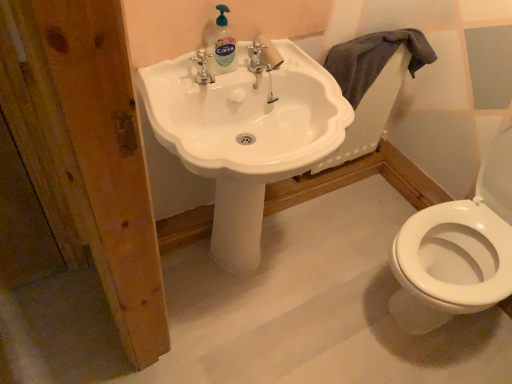
Question: Looking at the image, does white glossy sink at center seem bigger or smaller compared to gray cotton towel at upper right?

Choices:
 (A) big
 (B) small

Answer: (A)

Question: From a real-world perspective, relative to gray cotton towel at upper right, is white glossy sink at center vertically above or below?

Choices:
 (A) above
 (B) below

Answer: (B)

Question: Which is nearer to the clear plastic bottle at upper center?

Choices:
 (A) gray cotton towel at upper right
 (B) white glossy sink at center

Answer: (B)

Question: Estimate the real-world distances between objects in this image. Which object is farther from the gray cotton towel at upper right?

Choices:
 (A) white glossy sink at center
 (B) clear plastic bottle at upper center

Answer: (B)